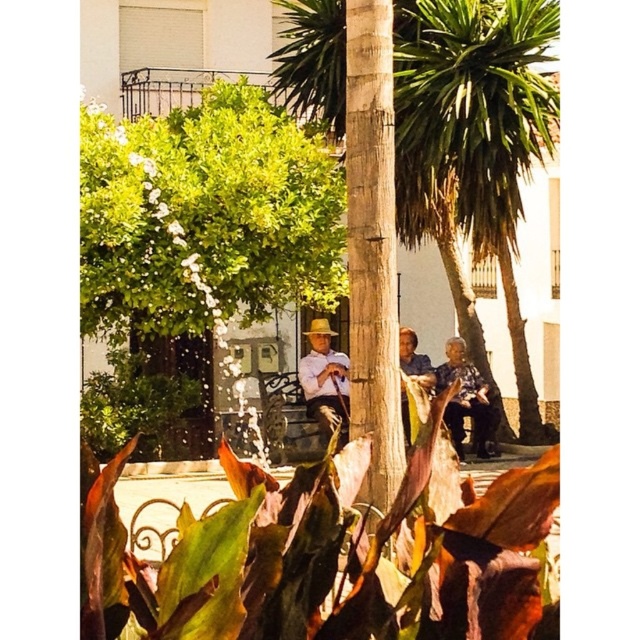
Question: Which point appears closest to the camera in this image?

Choices:
 (A) (445, 189)
 (B) (288, 186)
 (C) (330, 332)
 (D) (436, 378)

Answer: (B)

Question: Which object appears closest to the camera in this image?

Choices:
 (A) blue fabric shirt at center
 (B) green leafy palm tree at center

Answer: (A)

Question: Is green leafy palm tree at center positioned at the back of light brown straw hat at center?

Choices:
 (A) yes
 (B) no

Answer: (B)

Question: Can you confirm if green leafy palm tree at center is positioned to the right of light brown straw hat at center?

Choices:
 (A) yes
 (B) no

Answer: (A)

Question: In this image, where is green leafy palm tree at center located relative to light brown straw hat at center?

Choices:
 (A) left
 (B) right

Answer: (B)

Question: Which point is farther from the camera taking this photo?

Choices:
 (A) (464, 33)
 (B) (458, 436)
 (C) (269, 230)

Answer: (B)